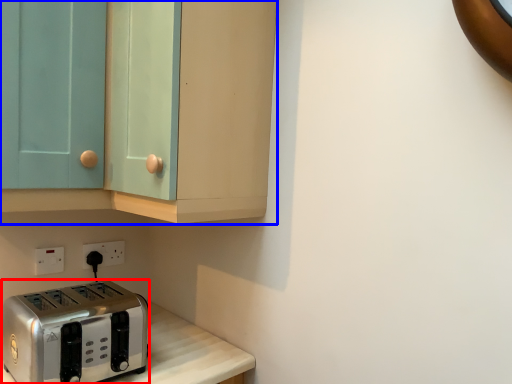
Question: Which object is closer to the camera taking this photo, toaster (highlighted by a red box) or cabinetry (highlighted by a blue box)?

Choices:
 (A) toaster
 (B) cabinetry

Answer: (B)